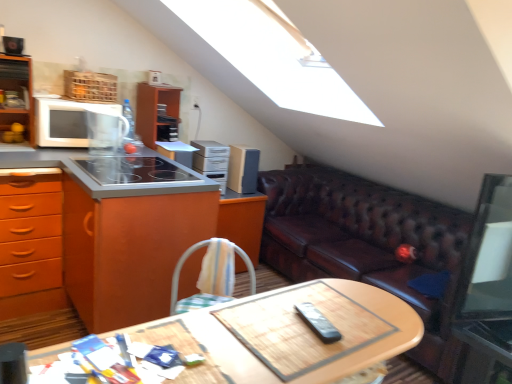
Question: Considering their positions, is black plastic remote at center, which is counted as the 4th appliance, starting from the back, located in front of or behind brown leather couch at right?

Choices:
 (A) behind
 (B) front

Answer: (B)

Question: In terms of width, does black plastic remote at center, which is counted as the 4th appliance, starting from the back, look wider or thinner when compared to brown leather couch at right?

Choices:
 (A) thin
 (B) wide

Answer: (A)

Question: Considering the real-world distances, which object is farthest from the wooden at center?

Choices:
 (A) brown leather couch at right
 (B) satin silver toaster at center, positioned as the third appliance in back-to-front order
 (C) black plastic remote at center, the fourth appliance in the left-to-right sequence
 (D) metallic silver side table at lower right
 (E) satin silver cabinet at upper center, which ranks as the third appliance in front-to-back order

Answer: (B)

Question: Estimate the real-world distances between objects in this image. Which object is farther from the white matte microwave at left?

Choices:
 (A) smooth glass cooktop at center left
 (B) orange wood cabinet at left
 (C) wooden at center
 (D) brown leather couch at right
 (E) satin silver toaster at center, positioned as the third appliance in back-to-front order

Answer: (C)